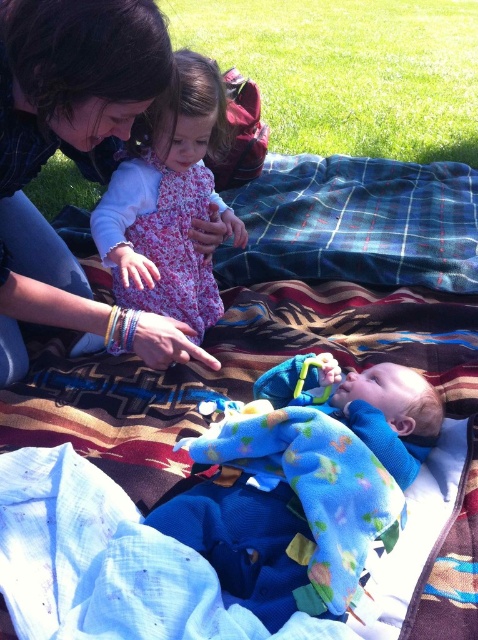
Question: Is matte black hair at upper left below green grass at upper center?

Choices:
 (A) no
 (B) yes

Answer: (B)

Question: Does soft blue plush toy at center appear over matte black hair at upper left?

Choices:
 (A) yes
 (B) no

Answer: (B)

Question: Which point is closer to the camera?

Choices:
 (A) (272, 508)
 (B) (148, 164)

Answer: (A)

Question: Which point appears closest to the camera in this image?

Choices:
 (A) (13, 152)
 (B) (215, 294)

Answer: (A)

Question: Estimate the real-world distances between objects in this image. Which object is closer to the green grass at upper center?

Choices:
 (A) matte black hair at upper left
 (B) floral dress at upper center

Answer: (B)

Question: Is matte black hair at upper left thinner than floral dress at upper center?

Choices:
 (A) no
 (B) yes

Answer: (A)